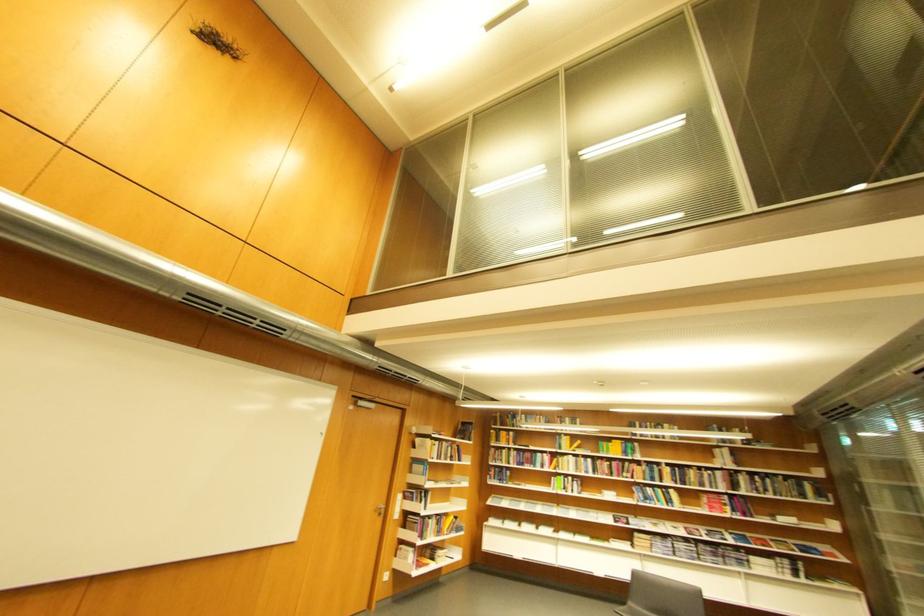
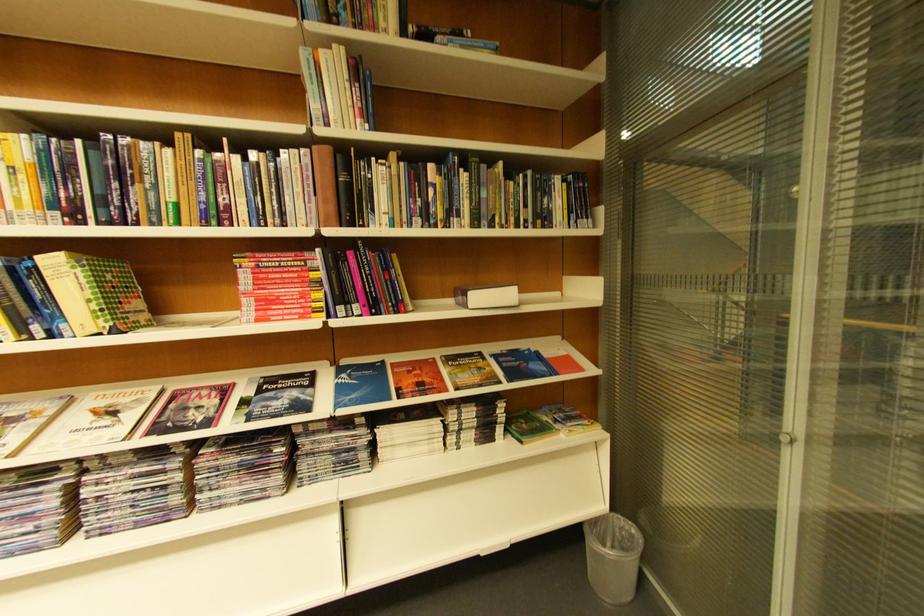
In the second image, find the point that corresponds to [815,496] in the first image.

(554, 221)